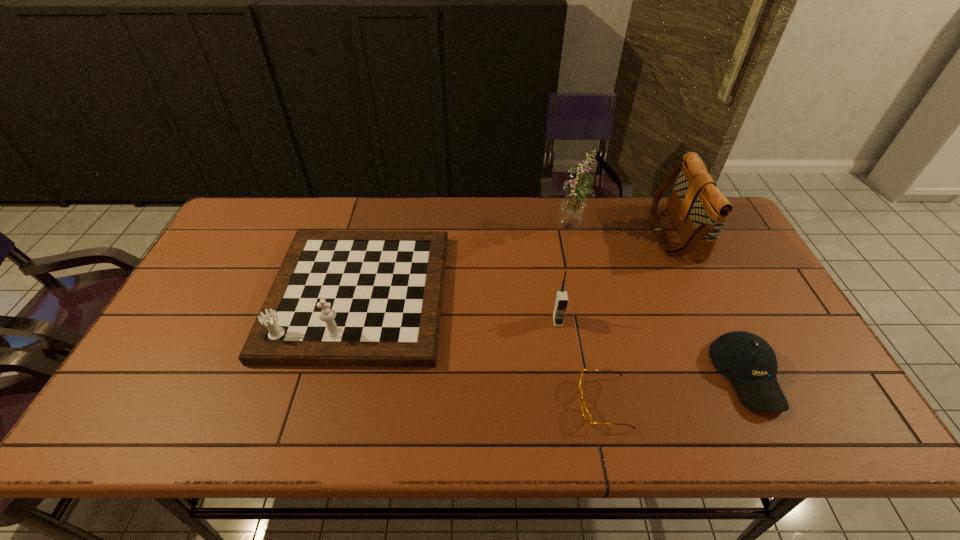
Identify the location of baseball cap present at the near edge. The width and height of the screenshot is (960, 540). (750, 364).

Identify the location of spectacles located in the near edge section of the desktop. The width and height of the screenshot is (960, 540). (586, 413).

This screenshot has height=540, width=960. Find the location of `shoulder bag that is positioned at the right edge`. shoulder bag that is positioned at the right edge is located at coordinates (699, 209).

This screenshot has width=960, height=540. In order to click on baseball cap that is positioned at the right edge in this screenshot , I will do [750, 364].

The height and width of the screenshot is (540, 960). I want to click on object positioned at the far right corner, so click(x=699, y=209).

Where is `object at the near right corner`? This screenshot has width=960, height=540. object at the near right corner is located at coordinates (750, 364).

The height and width of the screenshot is (540, 960). Identify the location of free location at the far edge. (557, 195).

In the image, there is a desktop. Where is `vacant space at the near edge`? vacant space at the near edge is located at coordinates (486, 418).

In the image, there is a desktop. Where is `free region at the left edge`? This screenshot has height=540, width=960. free region at the left edge is located at coordinates (240, 248).

The height and width of the screenshot is (540, 960). I want to click on vacant position at the right edge of the desktop, so click(763, 311).